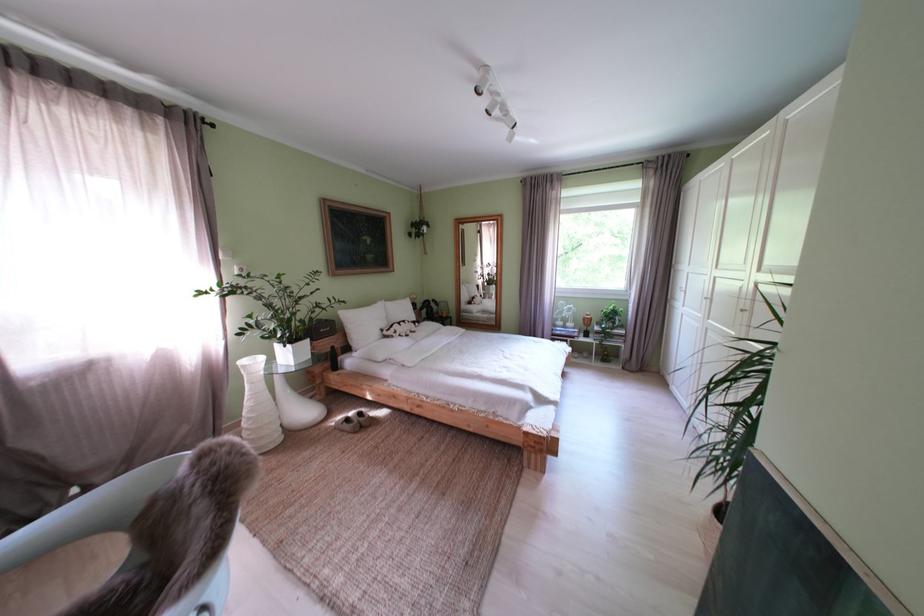
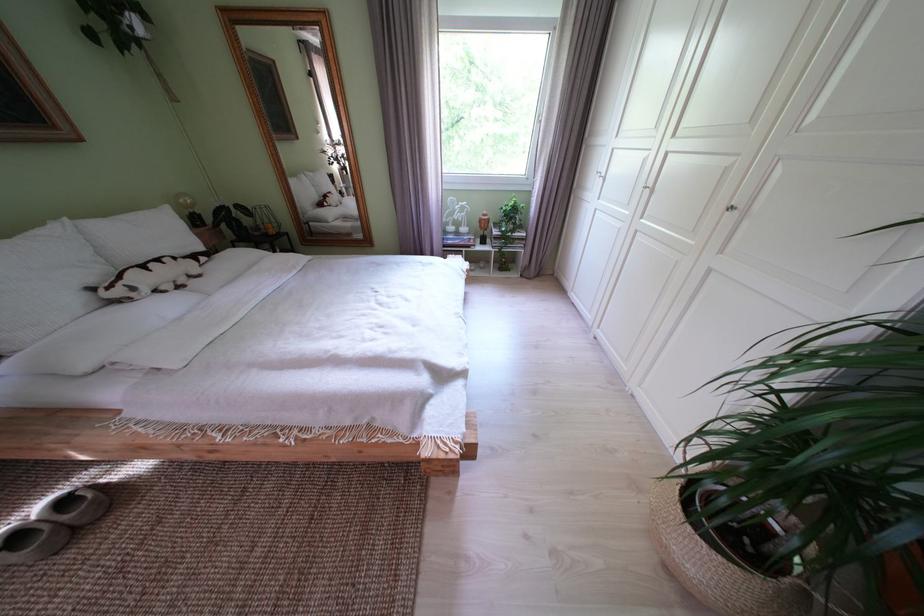
The first image is from the beginning of the video and the second image is from the end. How did the camera likely rotate when shooting the video?

The camera's rotation is toward right-down.